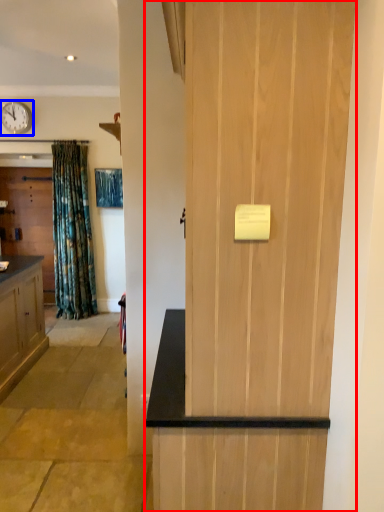
Question: Which object is further to the camera taking this photo, door (highlighted by a red box) or clock (highlighted by a blue box)?

Choices:
 (A) door
 (B) clock

Answer: (B)